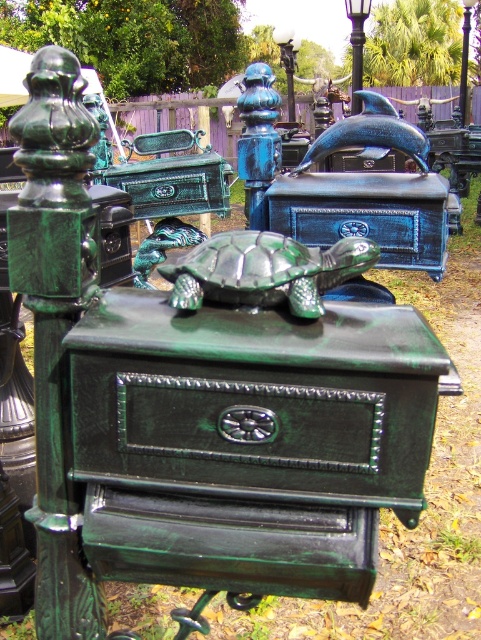
Who is lower down, metallic blue drawer at center or blue glass lamp post at upper center?

metallic blue drawer at center is below.

Looking at this image, does metallic blue drawer at center appear over blue glass lamp post at upper center?

No, metallic blue drawer at center is not above blue glass lamp post at upper center.

What are the coordinates of `metallic blue drawer at center` in the screenshot? It's located at pos(356,227).

The image size is (481, 640). Find the location of `metallic blue drawer at center`. metallic blue drawer at center is located at coordinates (356, 227).

Who is taller, green glossy drawer at center or blue glass lamp post at upper center?

blue glass lamp post at upper center is taller.

The image size is (481, 640). What do you see at coordinates (250, 422) in the screenshot?
I see `green glossy drawer at center` at bounding box center [250, 422].

I want to click on green glossy drawer at center, so click(x=250, y=422).

Between point (122, 387) and point (383, 241), which one is positioned behind?

Point (383, 241)

This screenshot has height=640, width=481. I want to click on green glossy drawer at center, so click(x=250, y=422).

What are the coordinates of `green glossy drawer at center` in the screenshot? It's located at (250, 422).